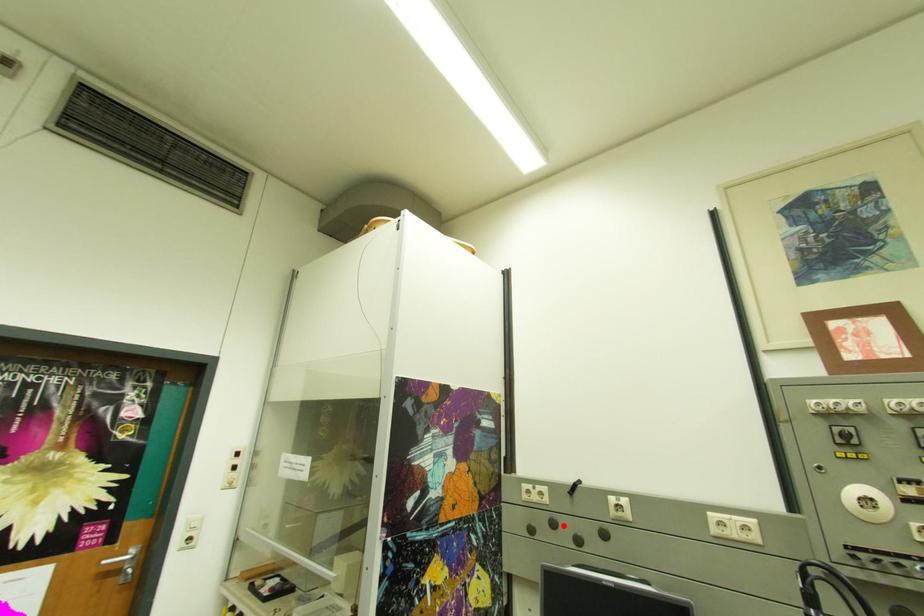
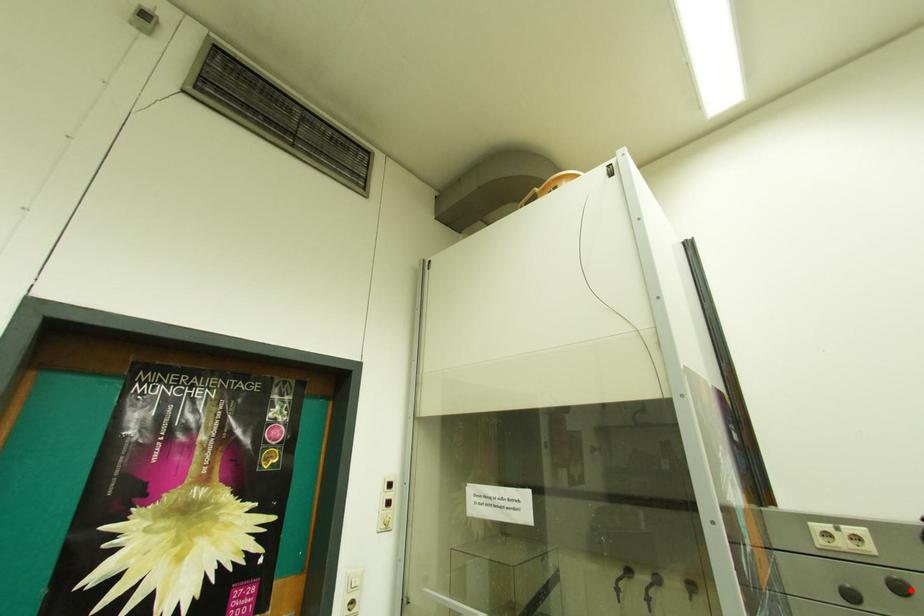
I am providing you with two images of the same scene from different viewpoints. A red point is marked on the first image and another point is marked on the second image. Is the marked point in image1 the same physical position as the marked point in image2?

Yes